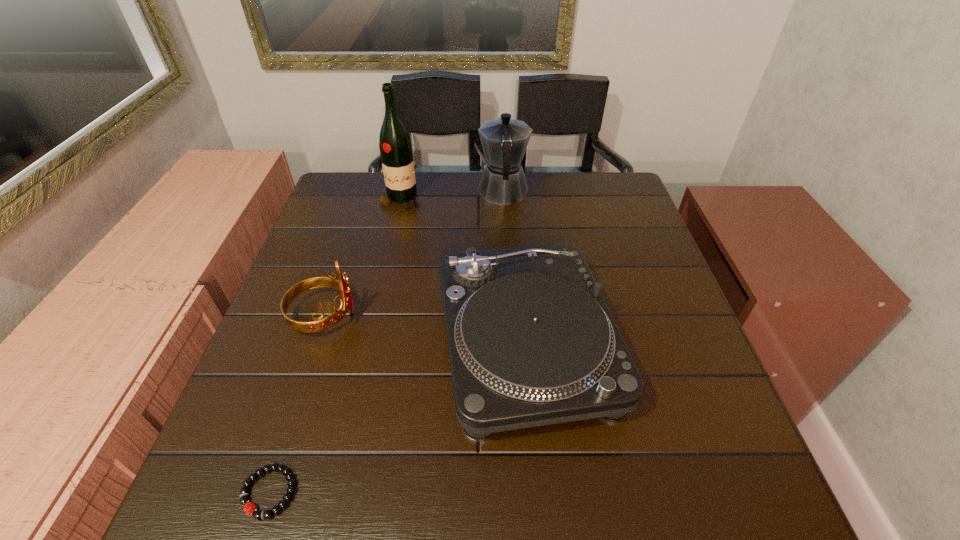
At what (x,y) coordinates should I click in order to perform the action: click on free spot at the left edge of the desktop. Please return your answer as a coordinate pair (x, y). The height and width of the screenshot is (540, 960). Looking at the image, I should click on coord(296,315).

Find the location of a particular element. Image resolution: width=960 pixels, height=540 pixels. blank space at the right edge is located at coordinates (662, 262).

This screenshot has height=540, width=960. I want to click on vacant space at the far left corner, so pyautogui.click(x=352, y=203).

In the image, there is a desktop. At what (x,y) coordinates should I click in order to perform the action: click on vacant space at the far right corner. Please return your answer as a coordinate pair (x, y). The image size is (960, 540). Looking at the image, I should click on (594, 182).

Find the location of a particular element. The image size is (960, 540). vacant space in between the tallest object and the second tallest object is located at coordinates (451, 197).

Where is `vacant point located between the nearest object and the second shortest object`? This screenshot has width=960, height=540. vacant point located between the nearest object and the second shortest object is located at coordinates (397, 417).

Locate an element on the screen. The width and height of the screenshot is (960, 540). vacant area between the shortest object and the tiara is located at coordinates (297, 404).

At what (x,y) coordinates should I click in order to perform the action: click on free spot between the record player and the nearest object. Please return your answer as a coordinate pair (x, y). Image resolution: width=960 pixels, height=540 pixels. Looking at the image, I should click on [397, 417].

Locate an element on the screen. This screenshot has height=540, width=960. free space between the record player and the tiara is located at coordinates (424, 329).

Find the location of a particular element. free space that is in between the shortest object and the record player is located at coordinates (397, 417).